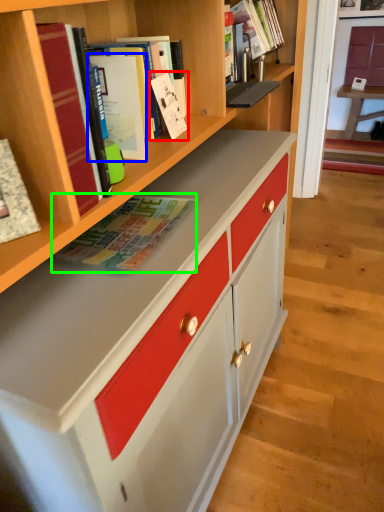
Question: Considering the real-world distances, which object is closest to book (highlighted by a red box)? paperback book (highlighted by a blue box) or book (highlighted by a green box).

Choices:
 (A) paperback book
 (B) book

Answer: (A)